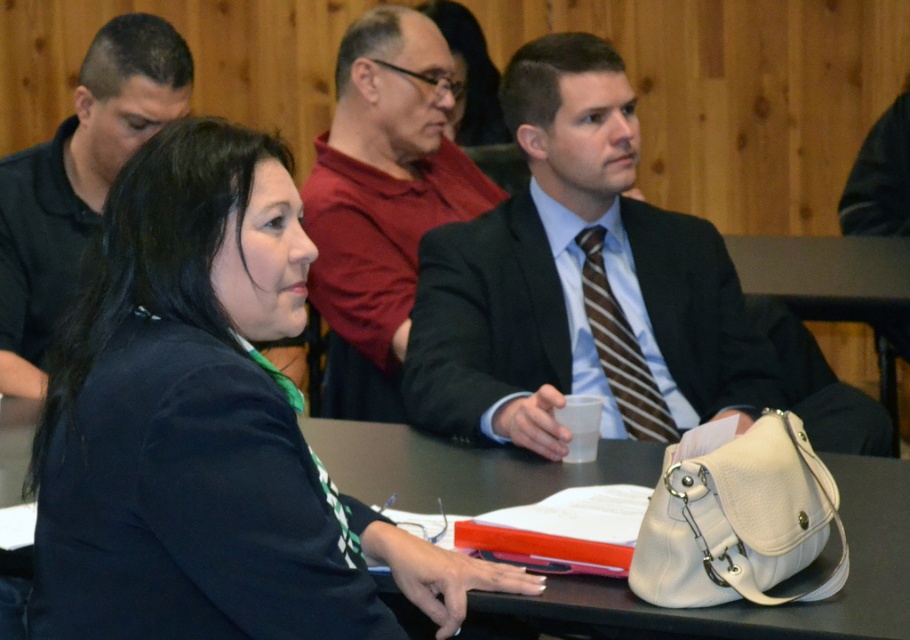
You are a photographer setting up for a group photo and need to ensure that both the matte black suit at center and the white leather handbag at lower center are visible in the frame. Based on their positions, which object should you focus on first to ensure both are in focus?

The matte black suit at center is above the white leather handbag at lower center, so focusing on the matte black suit at center first will help ensure both are in focus since it is positioned higher in the frame.

Consider the image. You are organizing a small event and need to place a decorative item between the black fabric jacket at center and the white leather handbag at lower center on the table. Since the space between them is limited, can you fit an item that is 15 cm wide?

The black fabric jacket at center is narrower than the white leather handbag at lower center. The width of the jacket is less than the handbag, so the 15 cm wide item may fit depending on the exact dimensions. However, without knowing the exact width of the jacket and handbag, it is difficult to confirm.